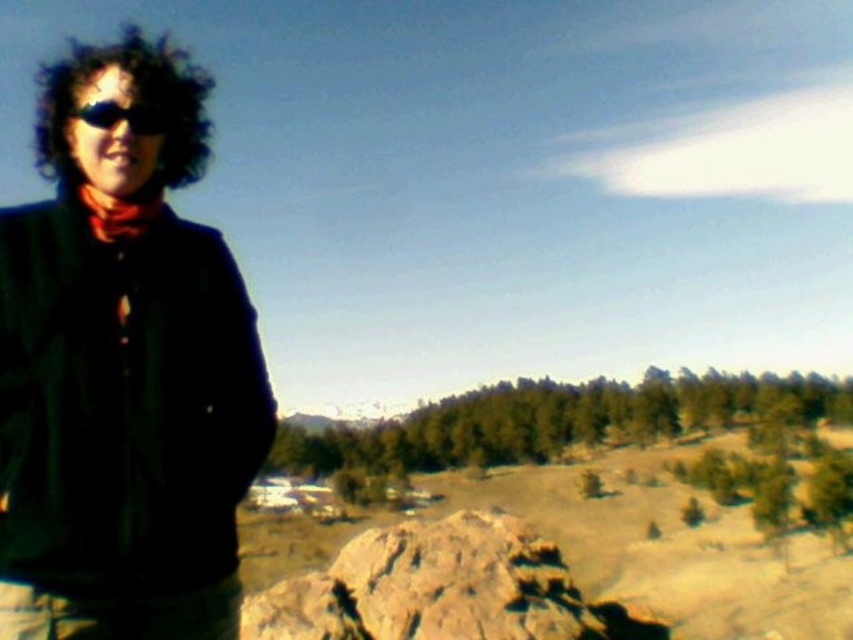
Does brown rough rock at center have a lesser width compared to black matte sunglasses at left?

No.

Between point (433, 544) and point (146, 113), which one is positioned behind?

The point (433, 544) is more distant.

Does point (451, 538) come closer to viewer compared to point (97, 100)?

No, it is behind (97, 100).

Identify the location of brown rough rock at center. (440, 588).

Which is above, dark green fabric jacket at left or brown rough rock at center?

dark green fabric jacket at left is above.

Who is lower down, dark green fabric jacket at left or brown rough rock at center?

Positioned lower is brown rough rock at center.

Who is more distant from viewer, (x=99, y=481) or (x=335, y=616)?

Positioned behind is point (x=335, y=616).

Find the location of a particular element. The height and width of the screenshot is (640, 853). dark green fabric jacket at left is located at coordinates (123, 403).

Does dark green fabric jacket at left appear on the right side of black matte sunglasses at left?

Yes, dark green fabric jacket at left is to the right of black matte sunglasses at left.

Is point (73, 435) positioned after point (103, 102)?

No, (73, 435) is in front of (103, 102).

Identify the location of dark green fabric jacket at left. (123, 403).